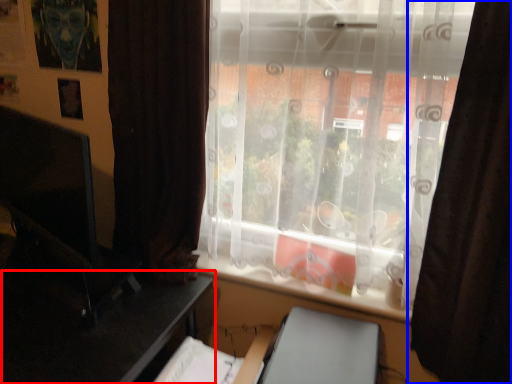
Question: Among these objects, which one is nearest to the camera, table (highlighted by a red box) or curtain (highlighted by a blue box)?

Choices:
 (A) table
 (B) curtain

Answer: (B)